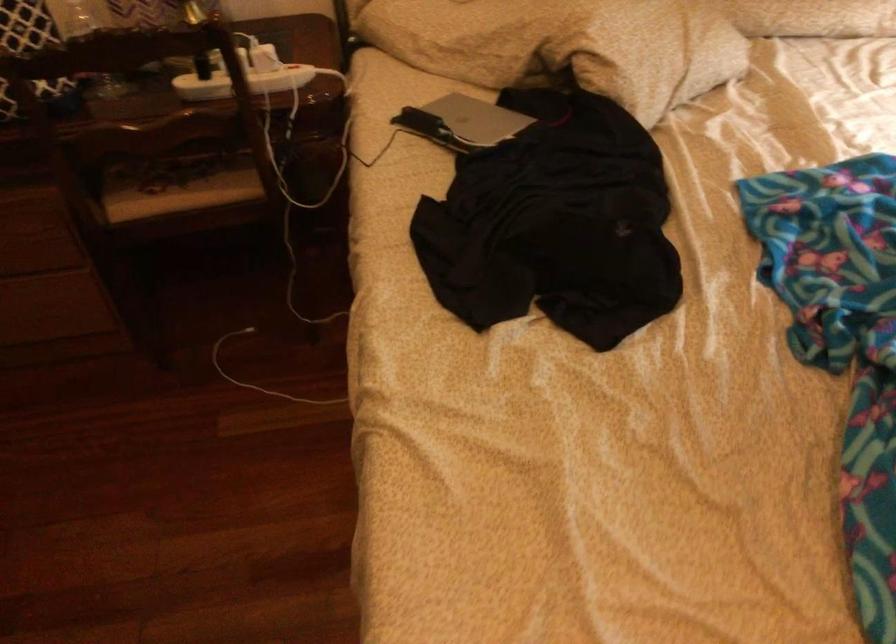
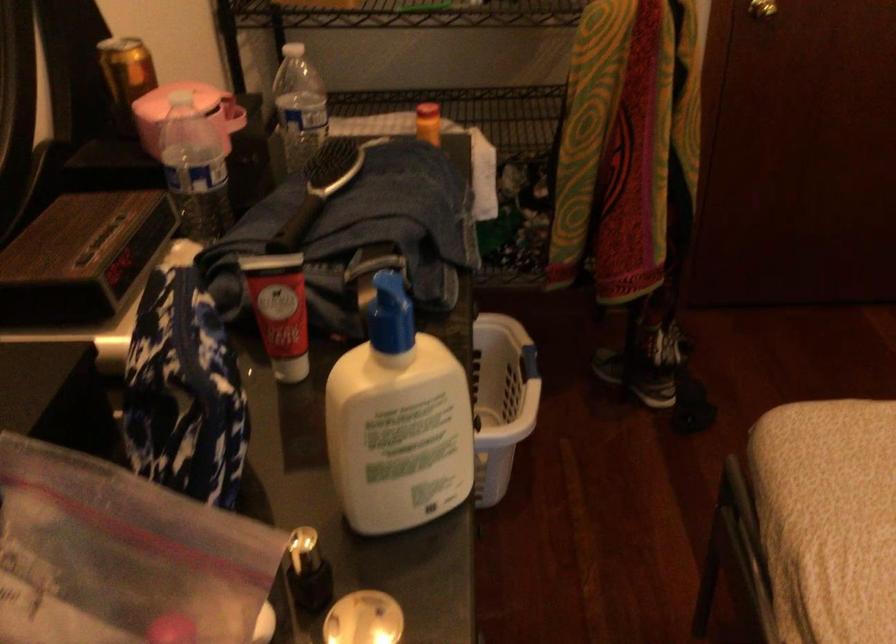
The images are taken continuously from a first-person perspective. In which direction is your viewpoint rotating?

The camera's rotation is toward left-down.